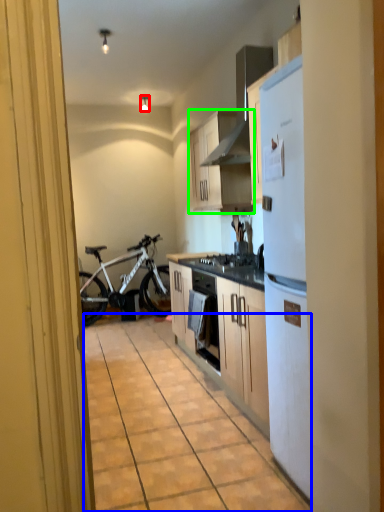
Question: Which object is the farthest from lamp (highlighted by a red box)? Choose among these: alley (highlighted by a blue box) or cabinetry (highlighted by a green box).

Choices:
 (A) alley
 (B) cabinetry

Answer: (A)